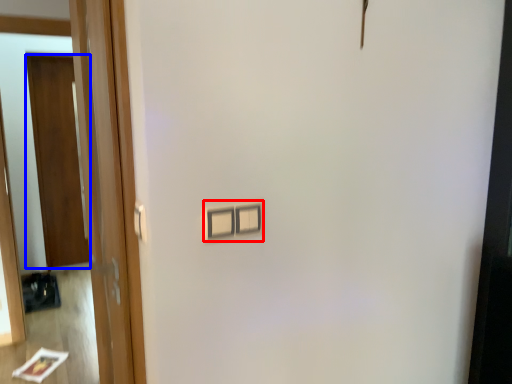
Question: Which object is further to the camera taking this photo, light switch (highlighted by a red box) or door (highlighted by a blue box)?

Choices:
 (A) light switch
 (B) door

Answer: (B)